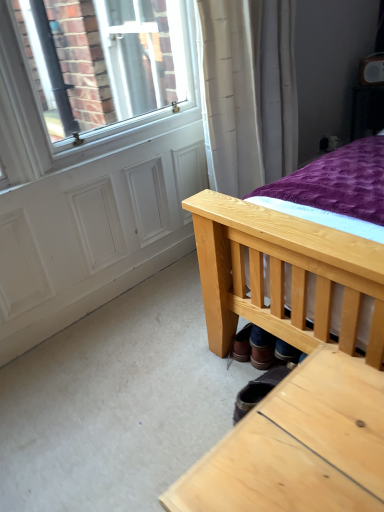
Question: Does point (258, 385) appear closer or farther from the camera than point (241, 360)?

Choices:
 (A) farther
 (B) closer

Answer: (B)

Question: Based on their sizes in the image, would you say leather boot at lower center is bigger or smaller than brown leather shoe at lower center?

Choices:
 (A) small
 (B) big

Answer: (B)

Question: Estimate the real-world distances between objects in this image. Which object is farther from the light wood table at lower right?

Choices:
 (A) white matte screen door at lower left
 (B) brown leather shoe at lower center
 (C) leather boot at lower center

Answer: (A)

Question: Which object is the farthest from the leather boot at lower center?

Choices:
 (A) brown leather shoe at lower center
 (B) light wood table at lower right
 (C) white matte screen door at lower left

Answer: (C)